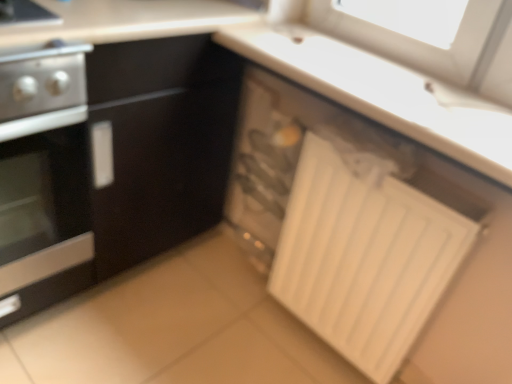
Where is `empty space that is ontop of white matte radiator at lower right (from a real-world perspective)`? empty space that is ontop of white matte radiator at lower right (from a real-world perspective) is located at coordinates (365, 152).